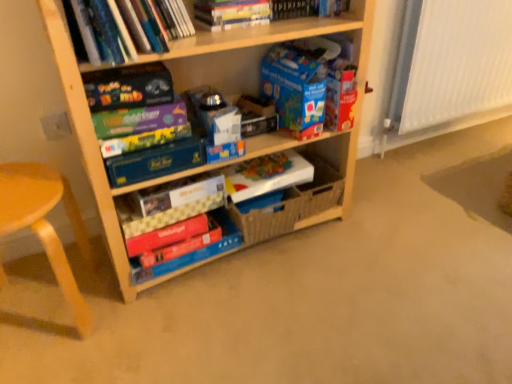
Question: From the image's perspective, is matte red book at center, the first paperback book when ordered from bottom to top, over hardcover book at upper center, the 4th book ordered from the bottom?

Choices:
 (A) no
 (B) yes

Answer: (A)

Question: From the image's perspective, is matte red book at center, which appears as the 8th paperback book when viewed from the top, below hardcover book at upper center, the 4th book ordered from the bottom?

Choices:
 (A) no
 (B) yes

Answer: (B)

Question: From a real-world perspective, is matte red book at center, the first paperback book when ordered from bottom to top, located beneath hardcover book at upper center, the 4th book ordered from the bottom?

Choices:
 (A) no
 (B) yes

Answer: (B)

Question: Is hardcover book at upper center, the 4th book ordered from the bottom, surrounded by matte red book at center, which appears as the 8th paperback book when viewed from the top?

Choices:
 (A) no
 (B) yes

Answer: (A)

Question: Does matte red book at center, which appears as the 8th paperback book when viewed from the top, have a greater width compared to hardcover book at upper center, which is counted as the 1th book, starting from the top?

Choices:
 (A) no
 (B) yes

Answer: (B)

Question: Can you confirm if matte red book at center, which appears as the 8th paperback book when viewed from the top, is bigger than hardcover book at upper center, which is counted as the 1th book, starting from the top?

Choices:
 (A) no
 (B) yes

Answer: (A)

Question: Is blue cardboard box at upper center, positioned as the 1th paperback book in top-to-bottom order, taller than red cardboard book at lower center, acting as the 1th book starting from the bottom?

Choices:
 (A) no
 (B) yes

Answer: (B)

Question: Is blue cardboard box at upper center, positioned as the 1th paperback book in top-to-bottom order, at the right side of red cardboard book at lower center, acting as the 1th book starting from the bottom?

Choices:
 (A) no
 (B) yes

Answer: (B)

Question: From a real-world perspective, is blue cardboard box at upper center, positioned as the 1th paperback book in top-to-bottom order, located higher than red cardboard book at lower center, acting as the fourth book starting from the top?

Choices:
 (A) yes
 (B) no

Answer: (A)

Question: Does blue cardboard box at upper center, which is the eighth paperback book in bottom-to-top order, touch red cardboard book at lower center, acting as the fourth book starting from the top?

Choices:
 (A) no
 (B) yes

Answer: (A)

Question: Are blue cardboard box at upper center, which is the eighth paperback book in bottom-to-top order, and red cardboard book at lower center, acting as the 1th book starting from the bottom, located far from each other?

Choices:
 (A) no
 (B) yes

Answer: (A)

Question: Is red cardboard book at lower center, acting as the fourth book starting from the top, a part of blue cardboard box at upper center, positioned as the 1th paperback book in top-to-bottom order?

Choices:
 (A) no
 (B) yes

Answer: (A)

Question: From a real-world perspective, is white paper at center, arranged as the 6th paperback book when viewed from the top, beneath matte black board game at upper left, the 7th paperback book from the bottom?

Choices:
 (A) yes
 (B) no

Answer: (A)